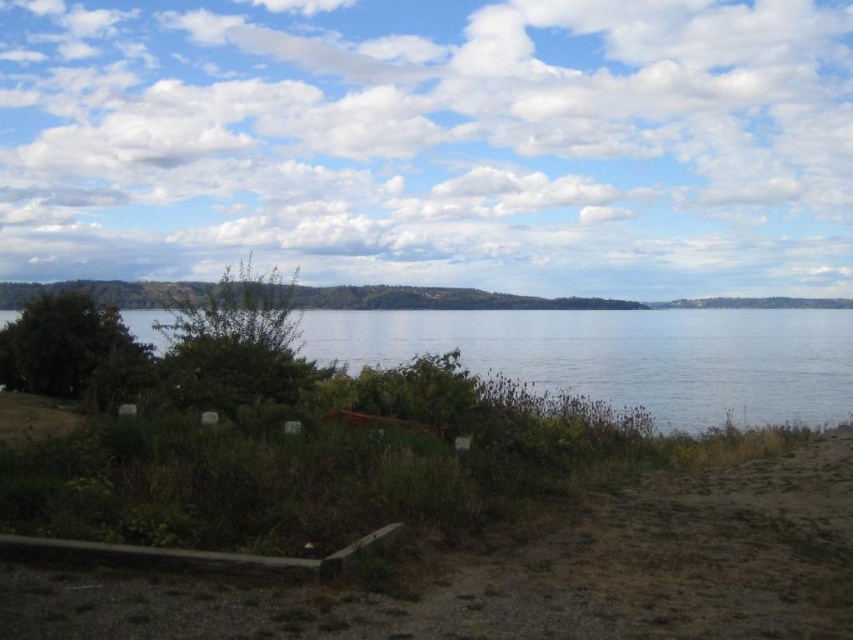
Question: Estimate the real-world distances between objects in this image. Which object is farther from the clear water at center?

Choices:
 (A) white fluffy cloud at upper center
 (B) green grass at lower center

Answer: (B)

Question: Can you confirm if green grass at lower center is thinner than clear water at center?

Choices:
 (A) no
 (B) yes

Answer: (B)

Question: Among these points, which one is farthest from the camera?

Choices:
 (A) (306, 323)
 (B) (808, 538)

Answer: (A)

Question: Is white fluffy cloud at upper center below clear water at center?

Choices:
 (A) yes
 (B) no

Answer: (B)

Question: Which point appears closest to the camera in this image?

Choices:
 (A) (637, 573)
 (B) (809, 81)

Answer: (A)

Question: From the image, what is the correct spatial relationship of white fluffy cloud at upper center in relation to clear water at center?

Choices:
 (A) above
 (B) below

Answer: (A)